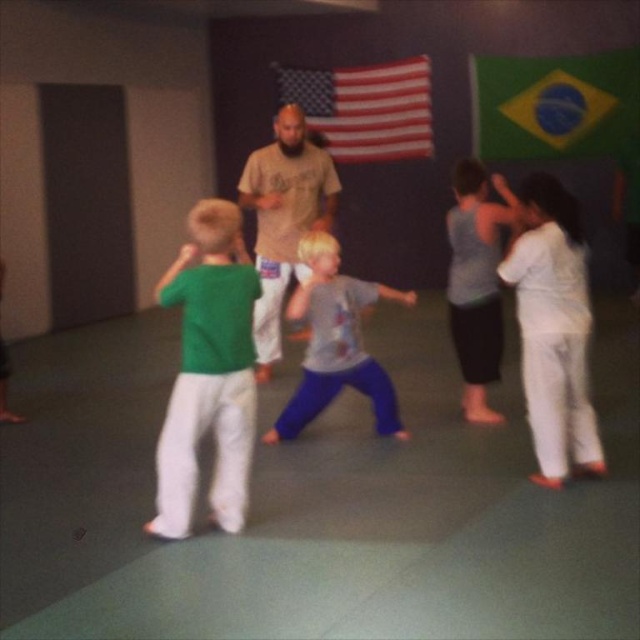
You are a photographer standing in the gymnasium where the martial arts class is taking place. You want to take a photo that includes both the American flag on the left and the Brazilian flag on the right. You have two points marked on your camera screen at coordinates point (x=193, y=296) and point (x=324, y=237). Which point is closer to you, the photographer?

Point (x=193, y=296) is closer to the viewer than point (x=324, y=237).

You are a photographer positioned at the back of the martial arts class. You want to take a photo of both the green cotton shirt at left and the white cotton shirt at upper right. Which shirt will appear larger in the photo?

The green cotton shirt at left will appear larger in the photo because it is closer to the viewer than the white cotton shirt at upper right.

You are a photographer in the back of the room. You want to take a picture of the gray cotton shirt at center without the green cotton shirt at left being visible in the frame. Is this possible?

The green cotton shirt at left is located below the gray cotton shirt at center, so if you position your camera to focus on the gray cotton shirt at center and avoid looking downward, the green cotton shirt at left should not be visible in the frame.